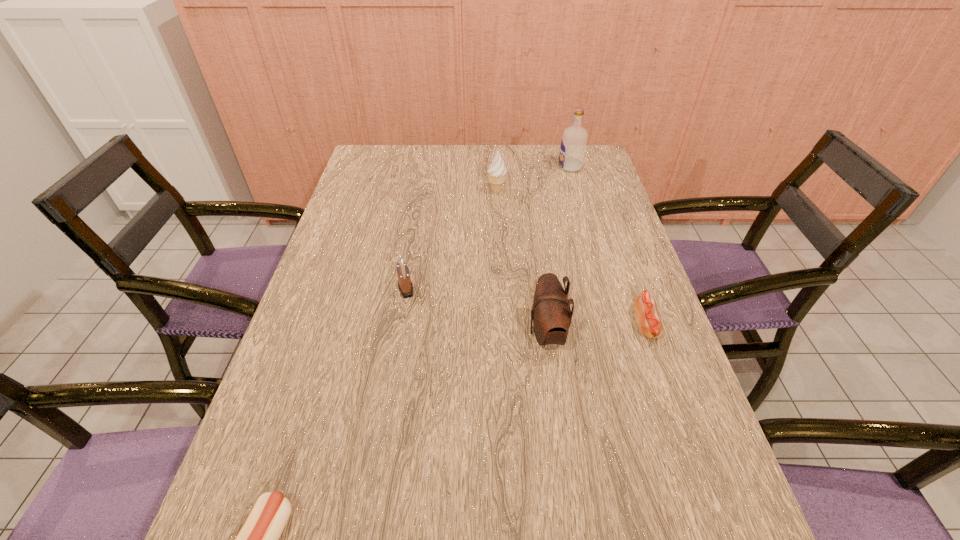
Identify the location of object that is at the far edge. The height and width of the screenshot is (540, 960). (573, 144).

Identify the location of vodka that is at the right edge. click(573, 144).

Locate an element on the screen. sausage at the right edge is located at coordinates (650, 325).

Locate an element on the screen. The width and height of the screenshot is (960, 540). object positioned at the far right corner is located at coordinates (573, 144).

The image size is (960, 540). I want to click on vacant space at the far edge of the desktop, so [488, 159].

At what (x,y) coordinates should I click in order to perform the action: click on free region at the left edge of the desktop. Please return your answer as a coordinate pair (x, y). Looking at the image, I should click on (373, 199).

You are a GUI agent. You are given a task and a screenshot of the screen. Output one action in this format:
    pyautogui.click(x=<x>, y=<y>)
    Task: Click on the vacant space at the right edge of the desktop
    
    Given the screenshot: What is the action you would take?
    pyautogui.click(x=587, y=255)

At what (x,y) coordinates should I click in order to perform the action: click on empty location between the icecream and the farther sausage. Please return your answer as a coordinate pair (x, y). Looking at the image, I should click on (571, 258).

This screenshot has height=540, width=960. What are the coordinates of `empty space between the tallest object and the third object from right to left` in the screenshot? It's located at (559, 250).

Identify the location of empty space that is in between the fourth nearest object and the pouch. (476, 310).